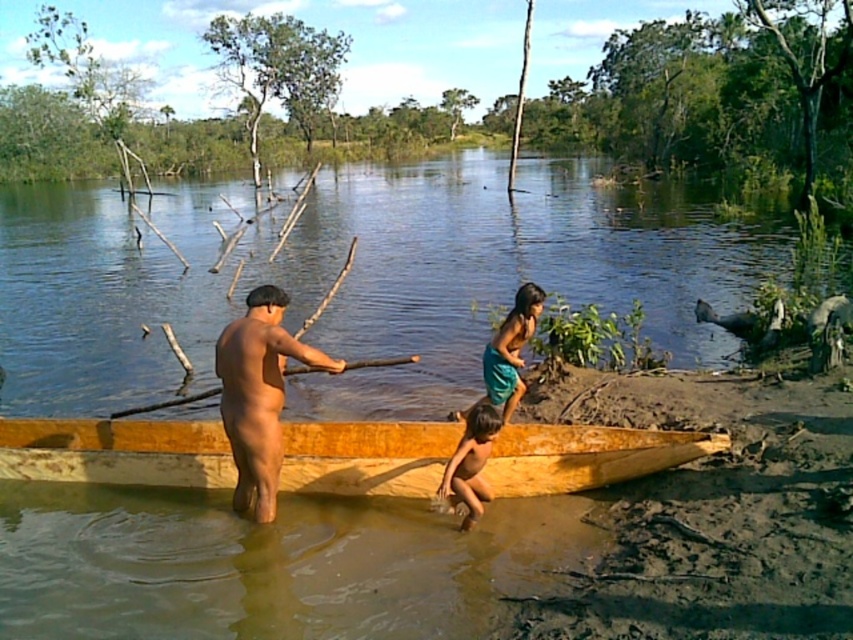
The width and height of the screenshot is (853, 640). What do you see at coordinates (117, 451) in the screenshot?
I see `light brown wooden boat at lower center` at bounding box center [117, 451].

Between point (358, 496) and point (230, 323), which one is positioned in front?

Point (358, 496) is more forward.

At what (x,y) coordinates should I click in order to perform the action: click on light brown wooden boat at lower center. Please return your answer as a coordinate pair (x, y). The height and width of the screenshot is (640, 853). Looking at the image, I should click on (117, 451).

Between light brown wooden boat at lower center and wooden stick at center, which one is positioned higher?

wooden stick at center is higher up.

I want to click on light brown wooden boat at lower center, so click(117, 451).

Locate an element on the screen. The width and height of the screenshot is (853, 640). light brown wooden boat at lower center is located at coordinates (117, 451).

Which is in front, point (497, 356) or point (496, 413)?

Point (496, 413) is in front.

Is teal fabric skirt at center below brown skin child at lower center?

Incorrect, teal fabric skirt at center is not positioned below brown skin child at lower center.

Is point (524, 307) positioned behind point (477, 456)?

Yes, it is behind point (477, 456).

Where is `teal fabric skirt at center`? Image resolution: width=853 pixels, height=640 pixels. teal fabric skirt at center is located at coordinates (508, 353).